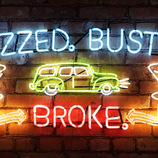
You are a GUI agent. You are given a task and a screenshot of the screen. Output one action in this format:
    pyautogui.click(x=<x>, y=<y>)
    Task: Click on the brick wall
    The width and height of the screenshot is (158, 158).
    Given the screenshot: What is the action you would take?
    pyautogui.click(x=21, y=85)